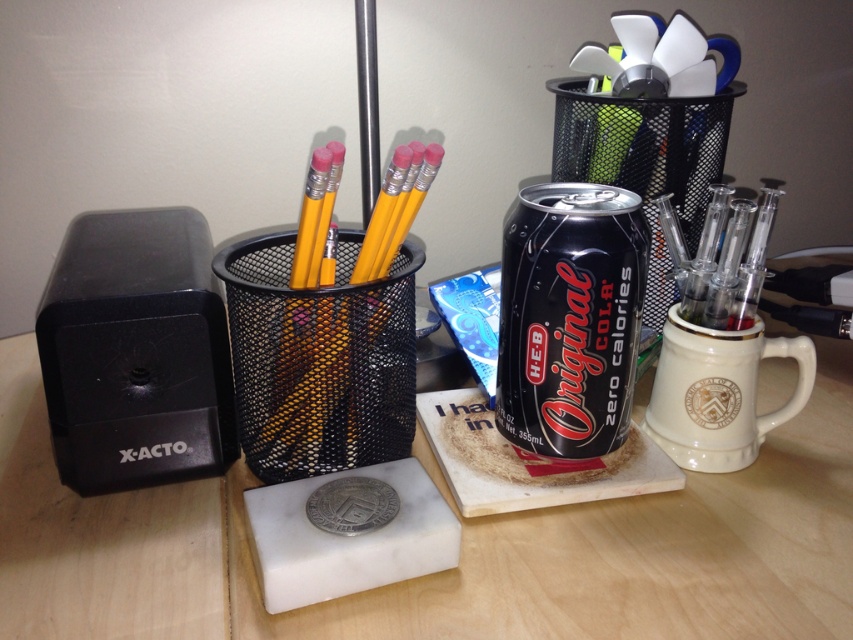
Question: Can you confirm if black metallic can at center is positioned to the left of white ceramic mug at right?

Choices:
 (A) yes
 (B) no

Answer: (A)

Question: Can you confirm if black plastic sharpener at left is smaller than white ceramic mug at right?

Choices:
 (A) no
 (B) yes

Answer: (A)

Question: Does black plastic sharpener at left have a smaller size compared to white ceramic mug at right?

Choices:
 (A) yes
 (B) no

Answer: (B)

Question: Which object is farther from the camera taking this photo?

Choices:
 (A) black metallic can at center
 (B) white ceramic mug at right
 (C) wooden table at center
 (D) black plastic sharpener at left

Answer: (B)

Question: Estimate the real-world distances between objects in this image. Which object is closer to the black metallic can at center?

Choices:
 (A) black plastic sharpener at left
 (B) white ceramic mug at right

Answer: (B)

Question: Which point is farther from the camera taking this photo?

Choices:
 (A) (685, 416)
 (B) (173, 224)
 (C) (508, 236)

Answer: (B)